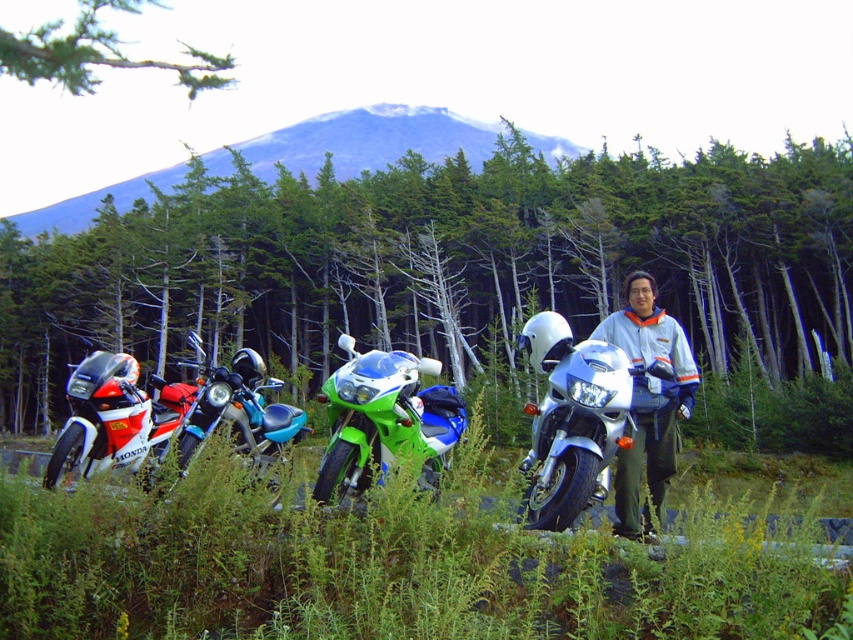
Question: Among these objects, which one is nearest to the camera?

Choices:
 (A) gray fabric jacket at center
 (B) white glossy motorcycle at center
 (C) green matte tree at center

Answer: (B)

Question: Is green matte tree at center closer to the viewer compared to shiny red motorcycle at left?

Choices:
 (A) no
 (B) yes

Answer: (A)

Question: Which point is farther to the camera?

Choices:
 (A) gray fabric jacket at center
 (B) green grass at lower center
 (C) green glossy sportbike at center
 (D) shiny red motorcycle at left

Answer: (A)

Question: Is green glossy sportbike at center further to camera compared to green leafy branch at upper left?

Choices:
 (A) yes
 (B) no

Answer: (B)

Question: Where is white glossy motorcycle at center located in relation to green glossy sportbike at center in the image?

Choices:
 (A) above
 (B) below

Answer: (A)

Question: Which of these objects is positioned closest to the green grass at lower center?

Choices:
 (A) green leafy branch at upper left
 (B) green glossy sportbike at center

Answer: (B)